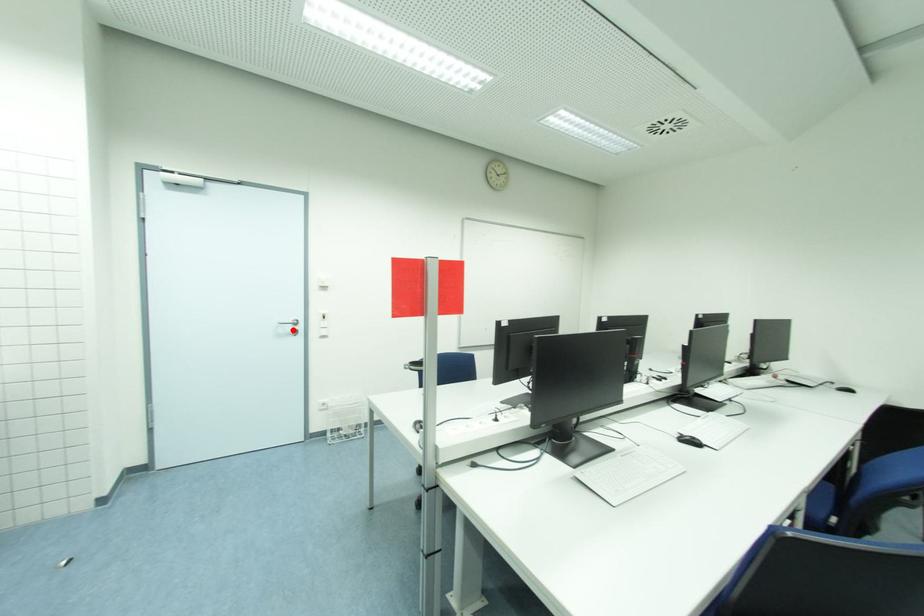
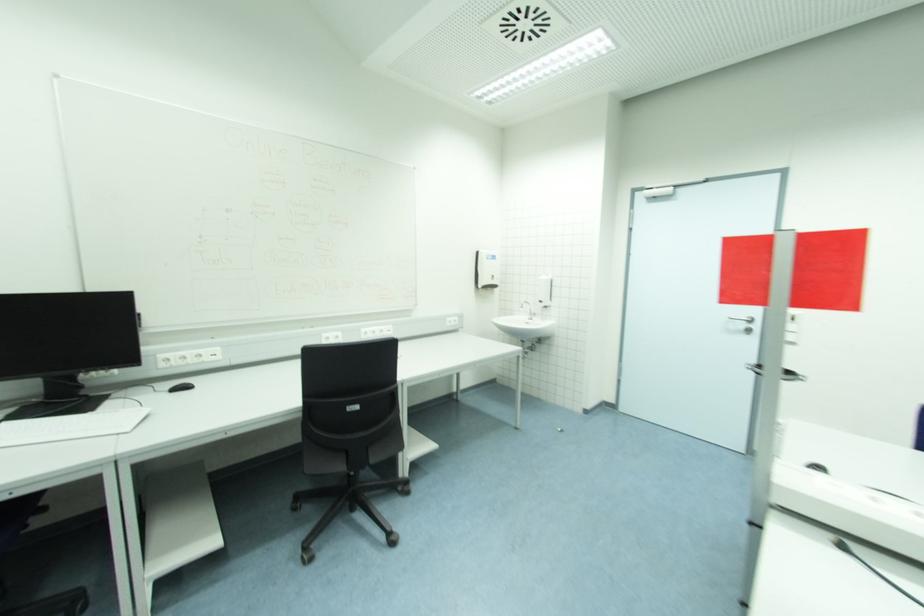
Where in the second image is the point corresponding to the highlighted location from the first image?

(746, 326)